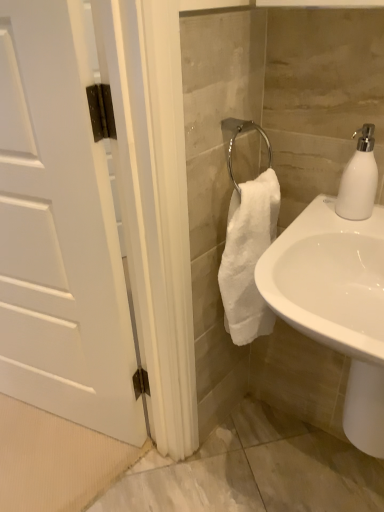
Where is `free area below white glossy sink at lower right (from a real-world perspective)`? The height and width of the screenshot is (512, 384). free area below white glossy sink at lower right (from a real-world perspective) is located at coordinates click(x=308, y=477).